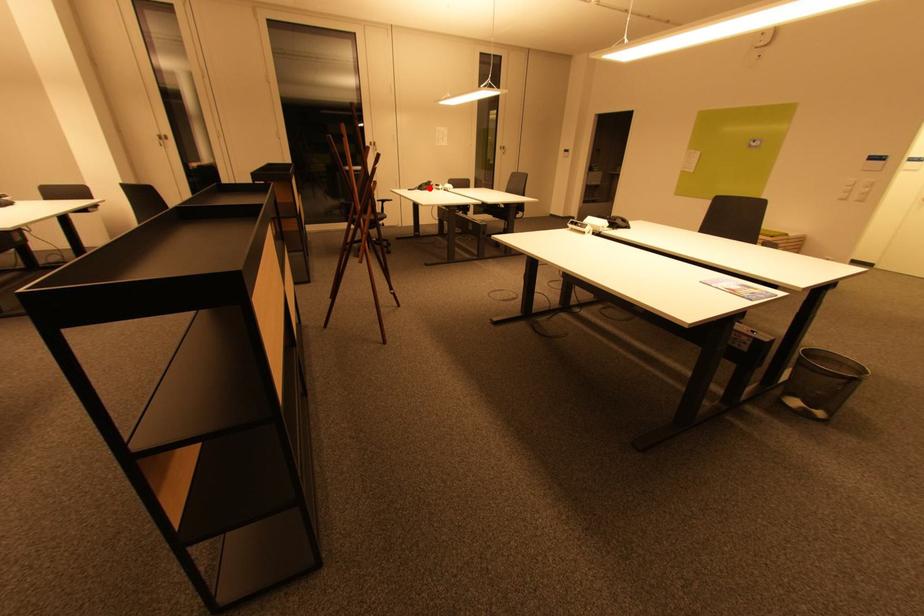
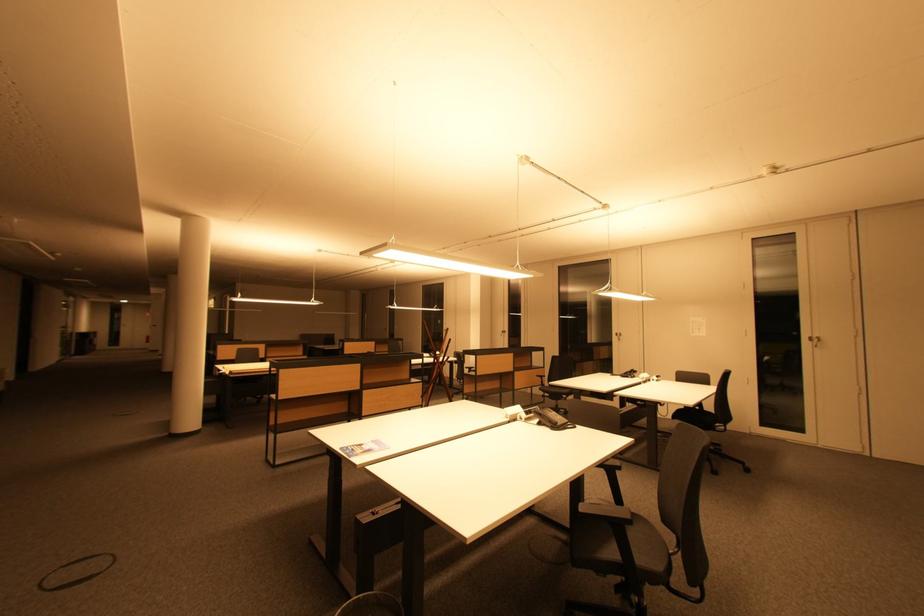
Question: I am providing you with two images of the same scene from different viewpoints. Image1 has a red point marked. In image2, the corresponding 3D location appears at what relative position? Reply with the corresponding letter.

Choices:
 (A) Closer
 (B) Farther

Answer: (B)